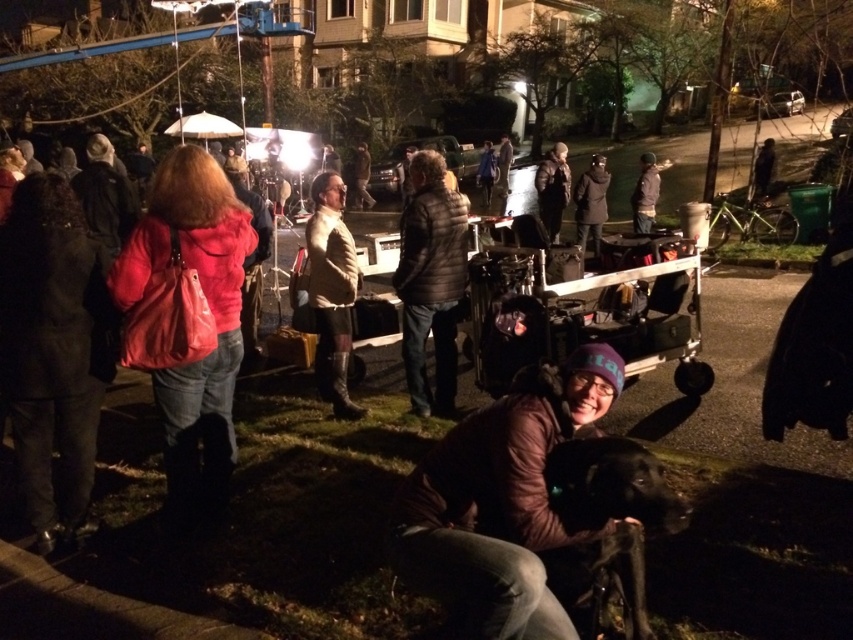
You are a film crew member who needs to move the metallic silver cart at center to a different location. However, you must ensure that the brown leather jacket at lower center is not obstructed from the camera. Based on their positions, can you move the cart without blocking the jacket?

The brown leather jacket at lower center is closer to the viewer than the metallic silver cart at center. Moving the cart would not obstruct the jacket since it is already behind the jacket in the scene.

You are a production assistant on set and need to move a 1.2 meter wide equipment case from the brown leather jacket at lower center to the metallic silver cart at center. Can you slide the case between them without moving either object?

The brown leather jacket at lower center is positioned on the left side of metallic silver cart at center. Since the objects are aligned horizontally, there is no space between them to slide the equipment case through. You would need to move at least one of the objects to create space.

You are a costume designer working on a film set. You need to place a brown leather jacket at lower center exactly at the coordinate point mentioned in the description. Where should you position it in the scene?

The brown leather jacket at lower center should be positioned at the coordinate point mentioned in the description, which is at point (502, 500).